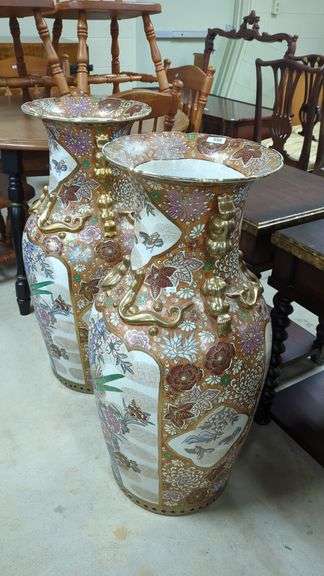
Locate the what you would serve food on in the image. Your answer should be formatted as a list of tuples, i.e. [(x1, y1), (x2, y2), ...], where each tuple contains the x and y coordinates of a point satisfying the conditions above.

[(19, 132)]